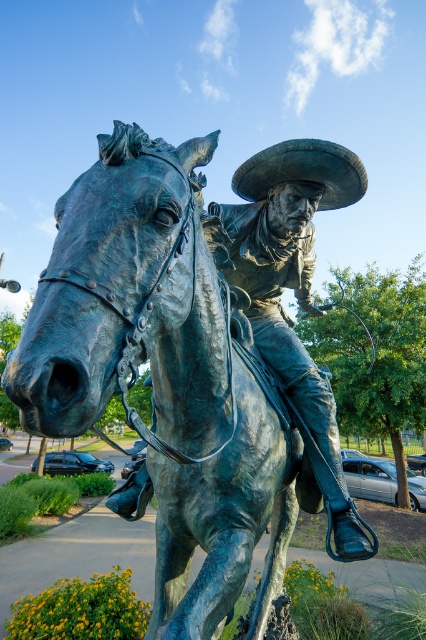
You are a sculptor who wants to place a 1.5 meter tall sculpture between the bronze statue of horse at center and the bronze textured cowboy hat at center. Can you fit it there?

The distance between the bronze statue of horse at center and the bronze textured cowboy hat at center is 1.63 meters. Since the sculpture is 1.5 meters tall, it can be placed between them as the space is sufficient.

You are a tour guide explaining the statue to visitors. You point out the bronze statue of horse at center and the bronze statue at center. Which one is positioned lower in the image?

The bronze statue of horse at center is positioned lower than the bronze statue at center.